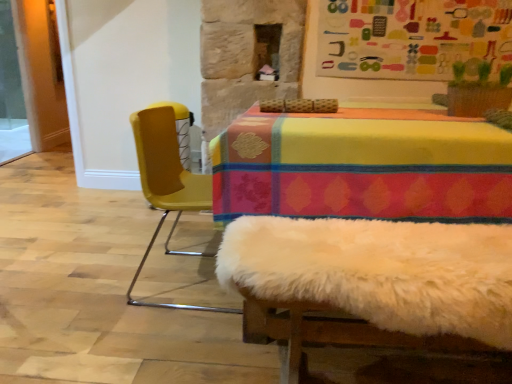
Locate an element on the screen. free space in front of yellow plastic chair at left is located at coordinates (166, 345).